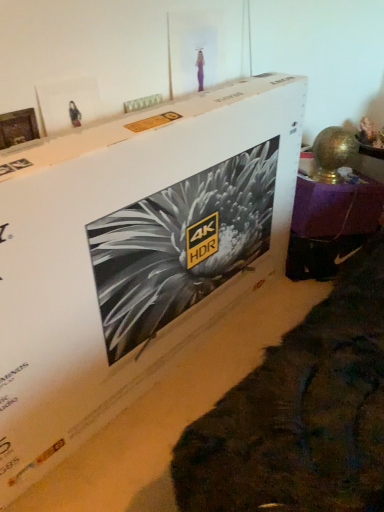
Question: Does metallic gold lamp at right come in front of wooden photo frame at upper left?

Choices:
 (A) no
 (B) yes

Answer: (A)

Question: Is metallic gold lamp at right aimed at wooden photo frame at upper left?

Choices:
 (A) no
 (B) yes

Answer: (A)

Question: Is metallic gold lamp at right with wooden photo frame at upper left?

Choices:
 (A) no
 (B) yes

Answer: (A)

Question: Is metallic gold lamp at right positioned behind wooden photo frame at upper left?

Choices:
 (A) yes
 (B) no

Answer: (A)

Question: Is metallic gold lamp at right thinner than wooden photo frame at upper left?

Choices:
 (A) yes
 (B) no

Answer: (B)

Question: Does metallic gold lamp at right appear on the left side of wooden photo frame at upper left?

Choices:
 (A) yes
 (B) no

Answer: (B)

Question: Considering the relative sizes of white cardboard box at center and wooden photo frame at upper left in the image provided, is white cardboard box at center taller than wooden photo frame at upper left?

Choices:
 (A) no
 (B) yes

Answer: (B)

Question: From a real-world perspective, is white cardboard box at center positioned over wooden photo frame at upper left based on gravity?

Choices:
 (A) yes
 (B) no

Answer: (B)

Question: Considering the relative sizes of white cardboard box at center and wooden photo frame at upper left in the image provided, is white cardboard box at center shorter than wooden photo frame at upper left?

Choices:
 (A) yes
 (B) no

Answer: (B)

Question: Does white cardboard box at center lie in front of wooden photo frame at upper left?

Choices:
 (A) no
 (B) yes

Answer: (B)

Question: Is white cardboard box at center wider than wooden photo frame at upper left?

Choices:
 (A) no
 (B) yes

Answer: (B)

Question: From the image's perspective, is white cardboard box at center located above wooden photo frame at upper left?

Choices:
 (A) yes
 (B) no

Answer: (B)

Question: Is wooden photo frame at upper left closer to camera compared to metallic gold lamp at right?

Choices:
 (A) no
 (B) yes

Answer: (B)